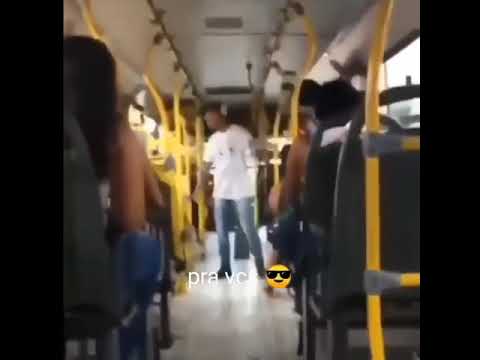
You are a GUI agent. You are given a task and a screenshot of the screen. Output one action in this format:
    pyautogui.click(x=<x>, y=<y>)
    Task: Click on the seats
    This screenshot has width=480, height=360.
    Given the screenshot: What is the action you would take?
    pyautogui.click(x=404, y=218), pyautogui.click(x=83, y=262), pyautogui.click(x=323, y=182), pyautogui.click(x=285, y=155)